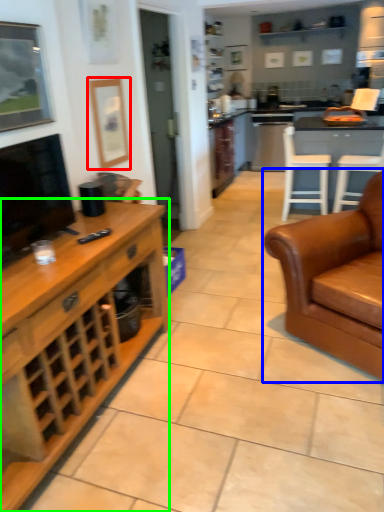
Question: Based on their relative distances, which object is nearer to picture frame (highlighted by a red box)? Choose from studio couch (highlighted by a blue box) and cabinetry (highlighted by a green box).

Choices:
 (A) studio couch
 (B) cabinetry

Answer: (B)